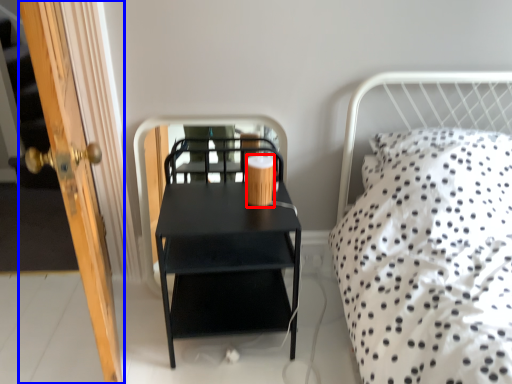
Question: Which point is further to the camera, coffee cup (highlighted by a red box) or door (highlighted by a blue box)?

Choices:
 (A) coffee cup
 (B) door

Answer: (A)